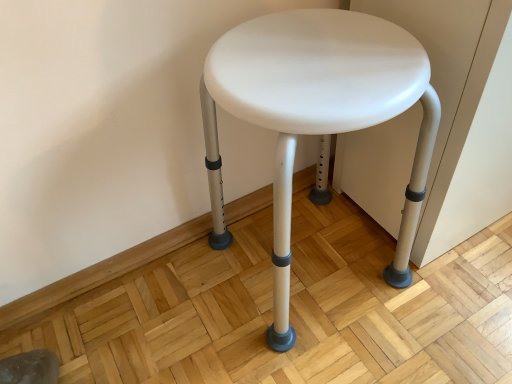
Question: In terms of size, does white plastic stool at center appear bigger or smaller than white plastic stool at center?

Choices:
 (A) big
 (B) small

Answer: (B)

Question: In the image, is white plastic stool at center on the left side or the right side of white plastic stool at center?

Choices:
 (A) right
 (B) left

Answer: (B)

Question: Relative to white plastic stool at center, is white plastic stool at center in front or behind?

Choices:
 (A) front
 (B) behind

Answer: (B)

Question: Based on their sizes in the image, would you say white plastic stool at center is bigger or smaller than white plastic stool at center?

Choices:
 (A) big
 (B) small

Answer: (A)

Question: Considering the positions of white plastic stool at center and white plastic stool at center in the image, is white plastic stool at center wider or thinner than white plastic stool at center?

Choices:
 (A) thin
 (B) wide

Answer: (B)

Question: Is white plastic stool at center inside the boundaries of white plastic stool at center, or outside?

Choices:
 (A) inside
 (B) outside

Answer: (B)

Question: From a real-world perspective, is white plastic stool at center positioned above or below white plastic stool at center?

Choices:
 (A) above
 (B) below

Answer: (A)